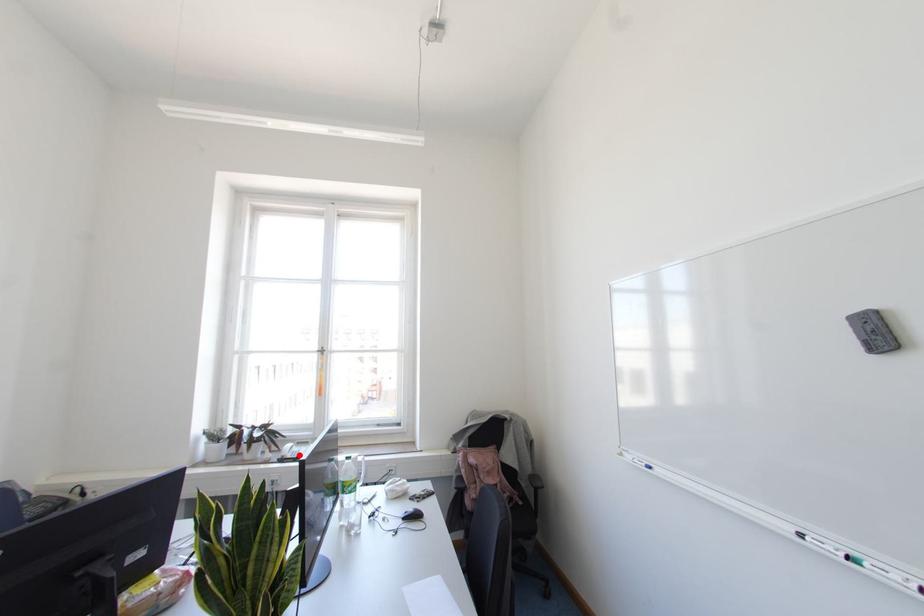
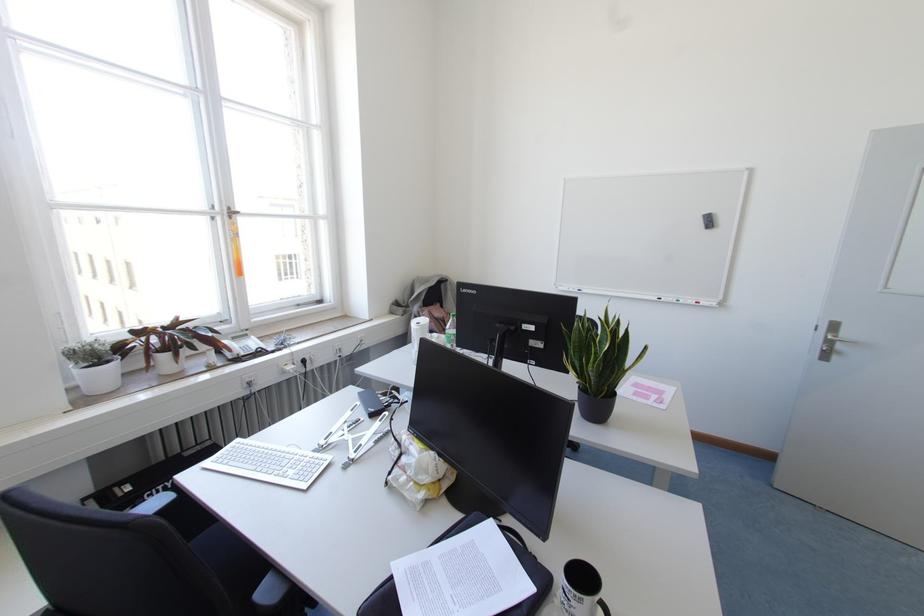
Find the pixel in the second image that matches the highlighted location in the first image.

(258, 349)